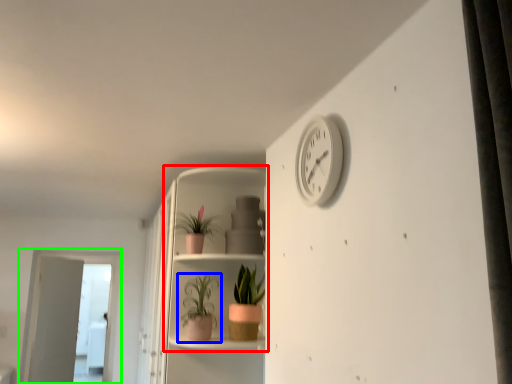
Question: Considering the real-world distances, which object is farthest from shelf (highlighted by a red box)? houseplant (highlighted by a blue box) or screen door (highlighted by a green box)?

Choices:
 (A) houseplant
 (B) screen door

Answer: (B)